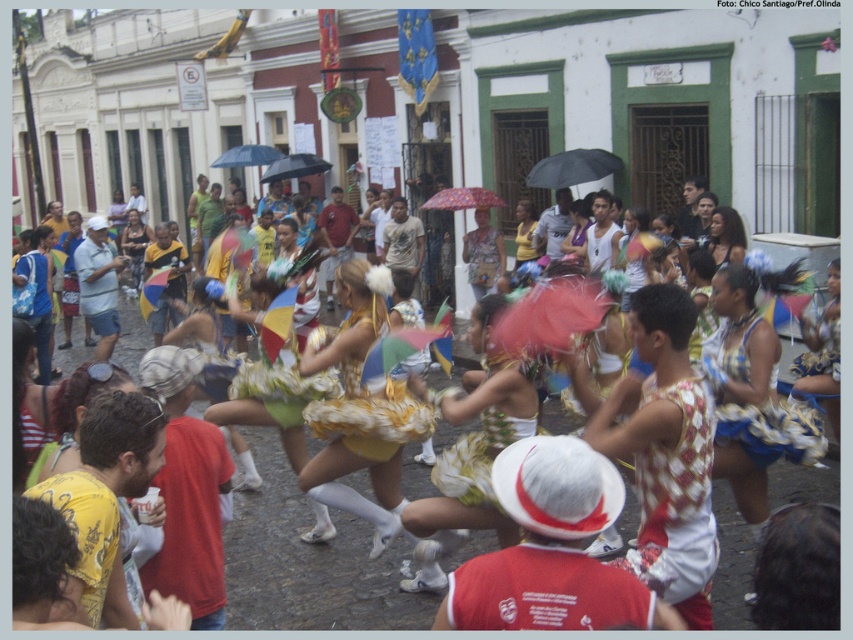
Question: Does gold sequined dress at center have a lesser width compared to black matte umbrella at upper center?

Choices:
 (A) yes
 (B) no

Answer: (A)

Question: Which of these objects is positioned closest to the gold sequined costume at center?

Choices:
 (A) black matte umbrella at center
 (B) black matte umbrella at upper center
 (C) gold sequined dress at center

Answer: (C)

Question: Does gold sequined dress at center have a greater width compared to black matte umbrella at center?

Choices:
 (A) no
 (B) yes

Answer: (A)

Question: Which point is closer to the camera taking this photo?

Choices:
 (A) (384, 390)
 (B) (631, 504)
 (C) (283, 163)

Answer: (A)

Question: Which point is closer to the camera taking this photo?

Choices:
 (A) (270, 595)
 (B) (323, 168)
 (C) (589, 157)
 (D) (393, 524)

Answer: (D)

Question: Does gold sequined dress at center have a larger size compared to black matte umbrella at center?

Choices:
 (A) yes
 (B) no

Answer: (A)